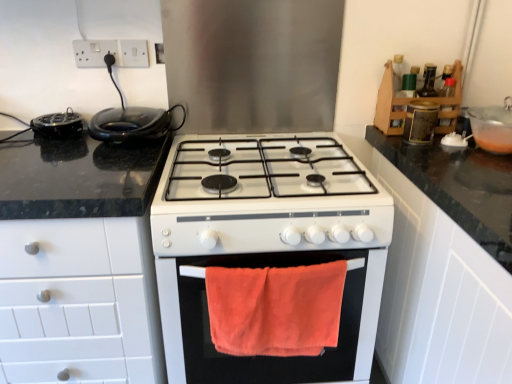
Locate an element on the screen. Image resolution: width=512 pixels, height=384 pixels. free spot to the left of black plastic toaster at left, which is the second appliance from top to bottom is located at coordinates 20,137.